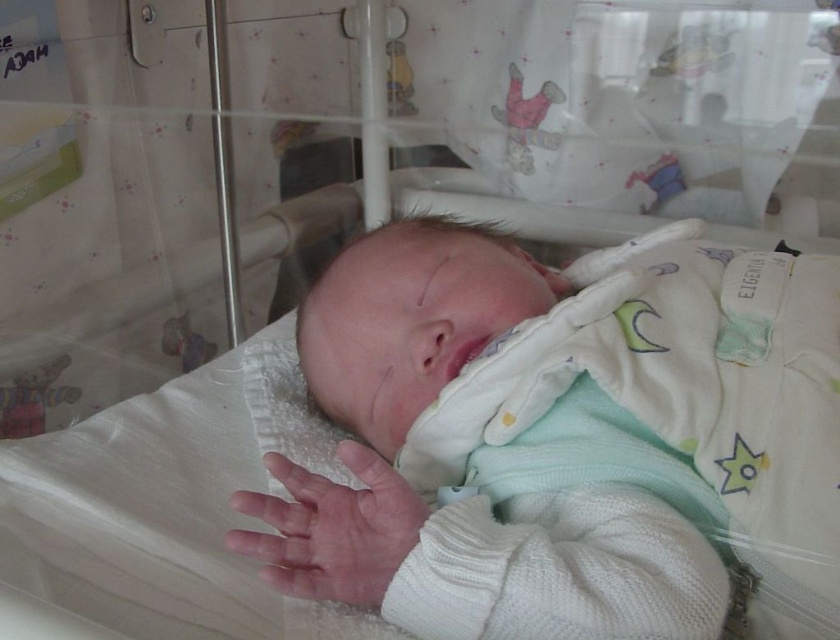
Who is more distant from viewer, (x=828, y=444) or (x=352, y=508)?

Positioned behind is point (x=828, y=444).

Who is more distant from viewer, (528, 605) or (235, 534)?

Point (235, 534)

Locate an element on the screen. This screenshot has height=640, width=840. white knitted sweater at center is located at coordinates (567, 438).